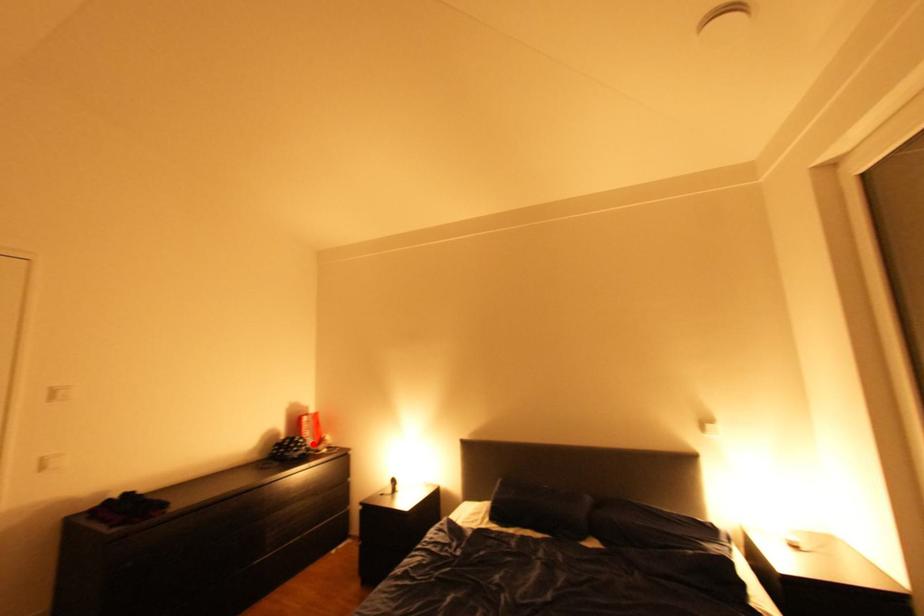
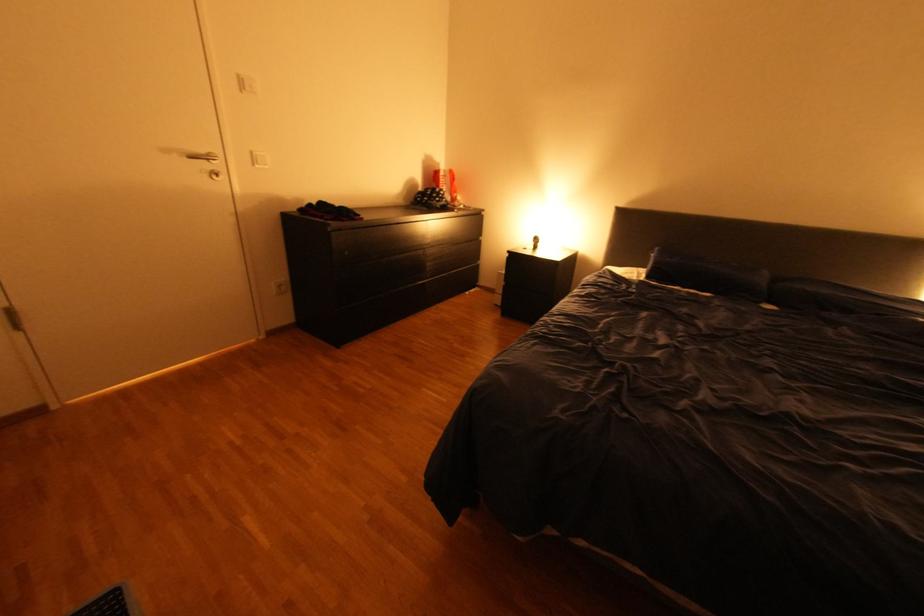
Locate, in the second image, the point that corresponds to the highlighted location in the first image.

(454, 196)